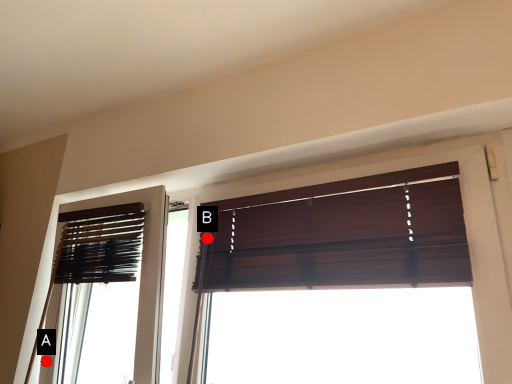
Question: Two points are circled on the image, labeled by A and B beside each circle. Among these points, which one is nearest to the camera?

Choices:
 (A) A is closer
 (B) B is closer

Answer: (B)